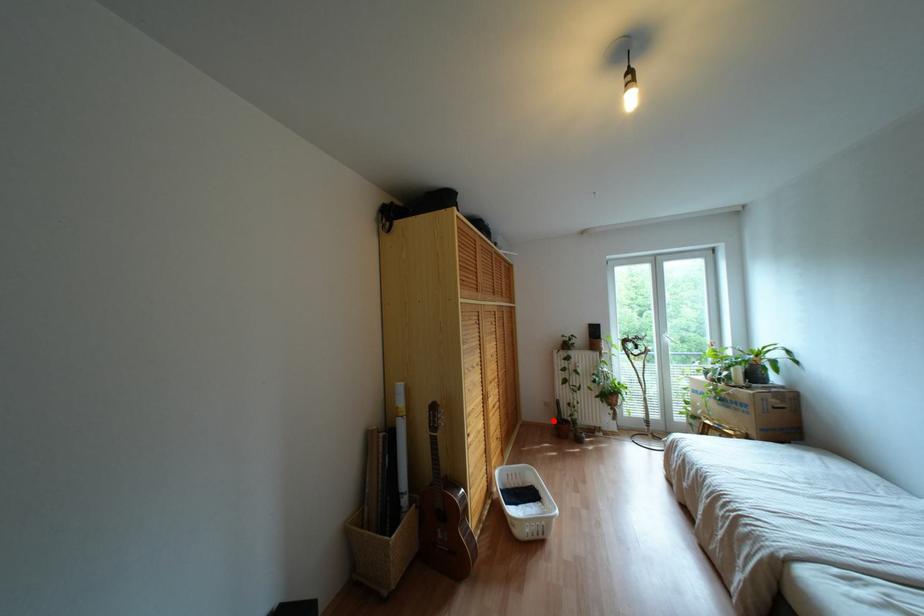
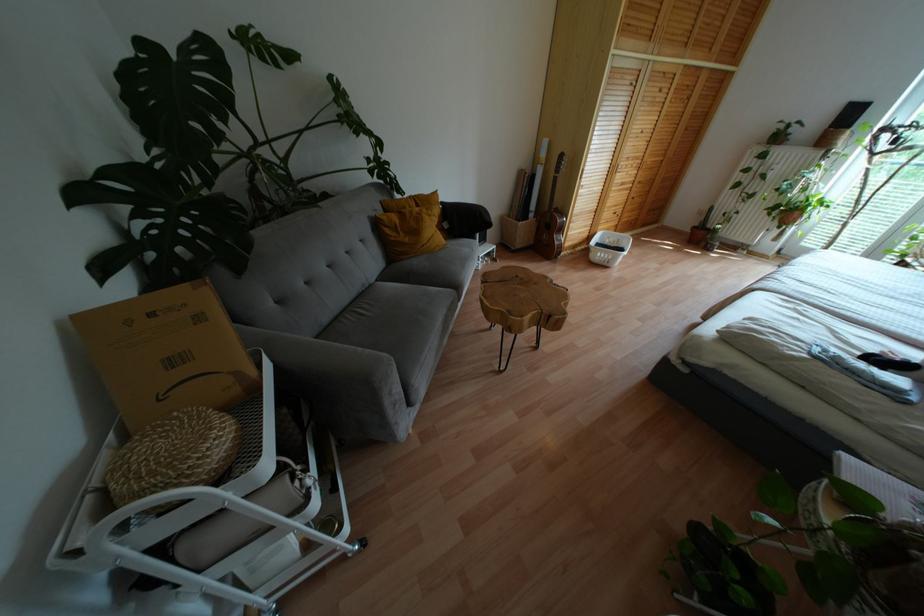
Question: I am providing you with two images of the same scene from different viewpoints. A red point is marked on the first image. Can you still see the location of the red point in image 2?

Choices:
 (A) Yes
 (B) No

Answer: (A)